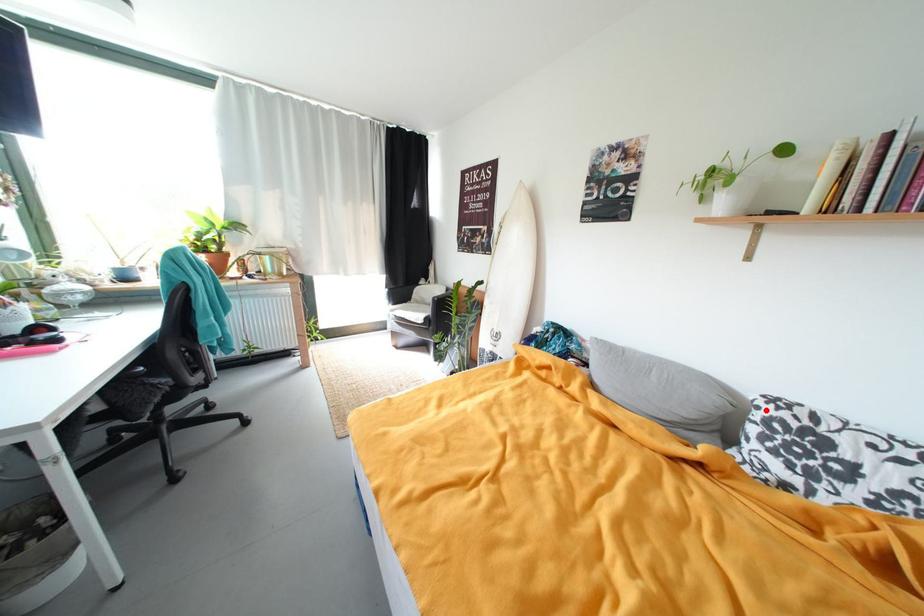
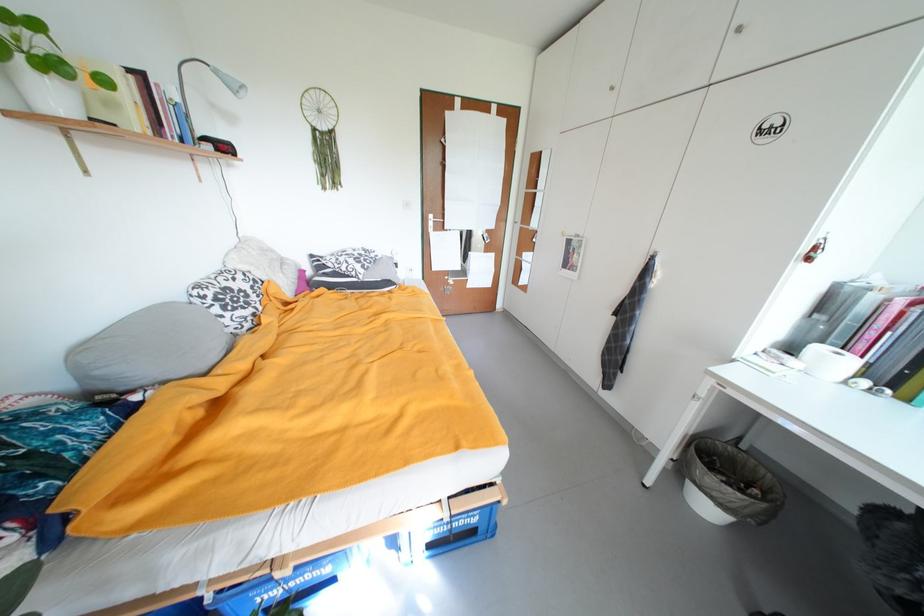
The point at the highlighted location is marked in the first image. Where is the corresponding point in the second image?

(211, 299)